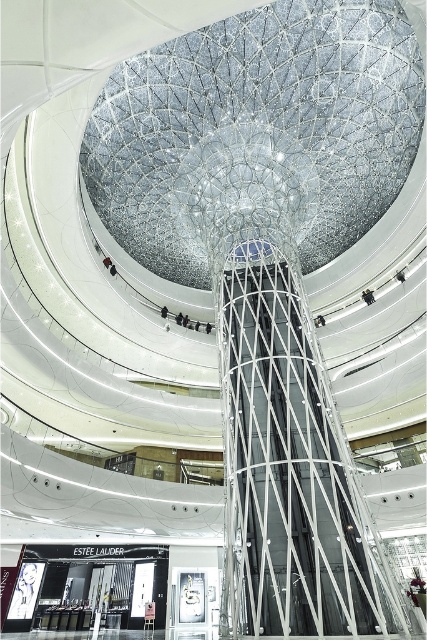
Can you confirm if transparent glass dome at center is wider than metallic wireframe escalator at center?

Indeed, transparent glass dome at center has a greater width compared to metallic wireframe escalator at center.

Does point (219, 92) lie in front of point (248, 296)?

No, (219, 92) is further to viewer.

Does point (371, 52) come farther from viewer compared to point (383, 621)?

Yes, it is.

Identify the location of transparent glass dome at center. (257, 134).